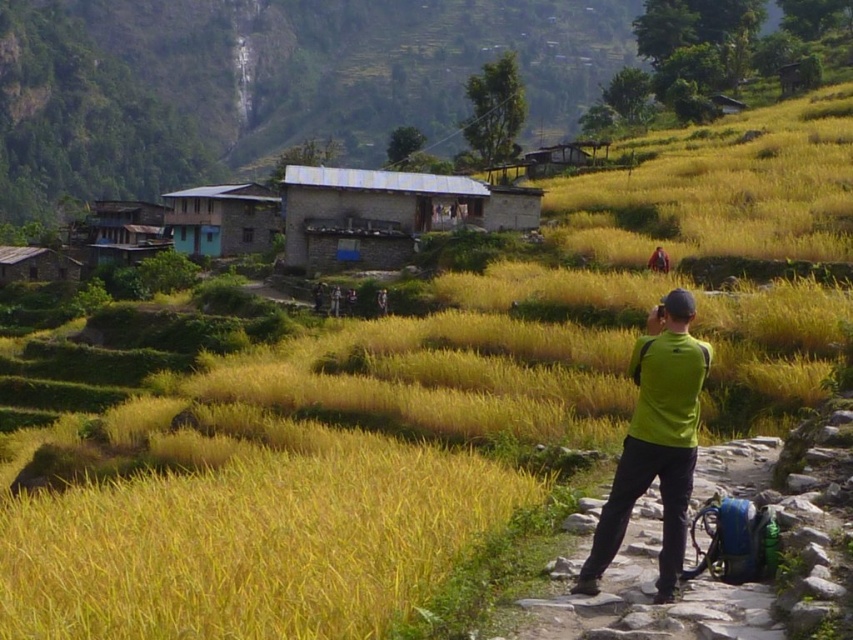
Question: Can you confirm if gray stone hut at center is smaller than green fabric shirt at right?

Choices:
 (A) yes
 (B) no

Answer: (B)

Question: Which point is closer to the camera?

Choices:
 (A) (643, 412)
 (B) (682, 618)
 (C) (238, 186)

Answer: (B)

Question: Is stone brick house at center to the right of green fabric shirt at right from the viewer's perspective?

Choices:
 (A) yes
 (B) no

Answer: (B)

Question: Is stone brick house at center positioned in front of gray stone hut at center?

Choices:
 (A) no
 (B) yes

Answer: (A)

Question: Based on their relative distances, which object is farther from the gray stone hut at center?

Choices:
 (A) blue painted wooden hut at center
 (B) green fabric bag at right
 (C) stone brick house at center

Answer: (B)

Question: Which of the following is the farthest from the observer?

Choices:
 (A) gray stone hut at center
 (B) green fabric shirt at right
 (C) blue painted wooden hut at center
 (D) stone brick house at center

Answer: (C)